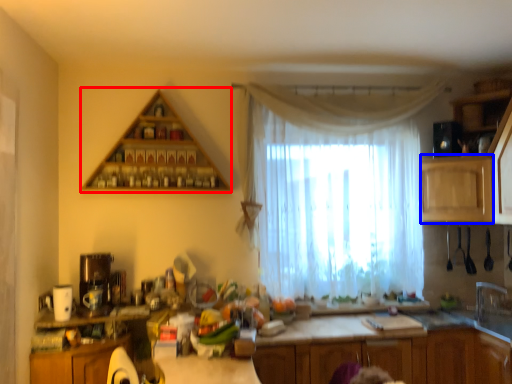
Question: Which object appears closest to the camera in this image, shelf (highlighted by a red box) or cabinetry (highlighted by a blue box)?

Choices:
 (A) shelf
 (B) cabinetry

Answer: (A)